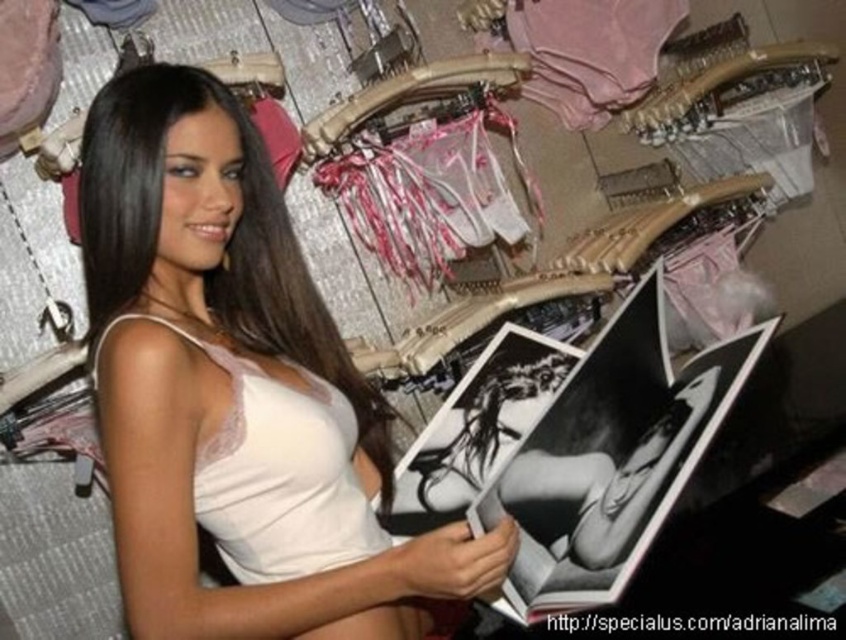
Question: Can you confirm if white satin bra at center is positioned to the left of white lace bikini top at center?

Choices:
 (A) yes
 (B) no

Answer: (A)

Question: Considering the relative positions of white satin bra at center and white lace bikini top at center in the image provided, where is white satin bra at center located with respect to white lace bikini top at center?

Choices:
 (A) below
 (B) above

Answer: (B)

Question: Is white satin bra at center in front of white lace bikini top at center?

Choices:
 (A) yes
 (B) no

Answer: (A)